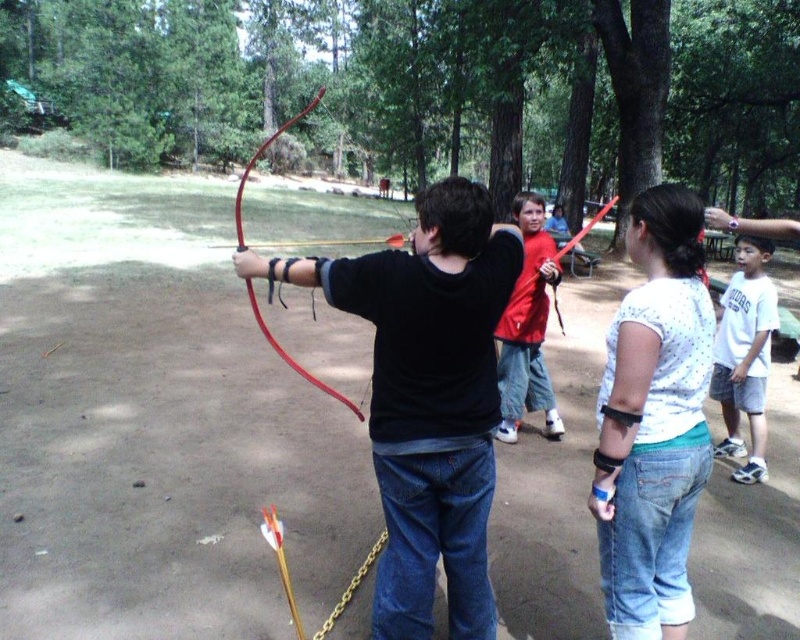
Is the position of matte black bow at center less distant than that of white cotton shirt at lower right?

Yes, it is.

Is point (430, 321) farther from viewer compared to point (754, 364)?

No, (430, 321) is in front of (754, 364).

The width and height of the screenshot is (800, 640). What do you see at coordinates (428, 397) in the screenshot? I see `matte black bow at center` at bounding box center [428, 397].

Identify the location of matte black bow at center. (428, 397).

Find the location of a particular element. matte black bow at center is located at coordinates (428, 397).

Is point (421, 280) positioned before point (537, 403)?

Yes.

The width and height of the screenshot is (800, 640). Find the location of `matte black bow at center`. matte black bow at center is located at coordinates pyautogui.click(x=428, y=397).

Can you confirm if white cotton shirt at lower right is positioned below red cotton shirt at center?

Indeed, white cotton shirt at lower right is positioned under red cotton shirt at center.

Is point (726, 346) less distant than point (528, 339)?

Yes, it is in front of point (528, 339).

Locate an element on the screen. The width and height of the screenshot is (800, 640). white cotton shirt at lower right is located at coordinates (744, 355).